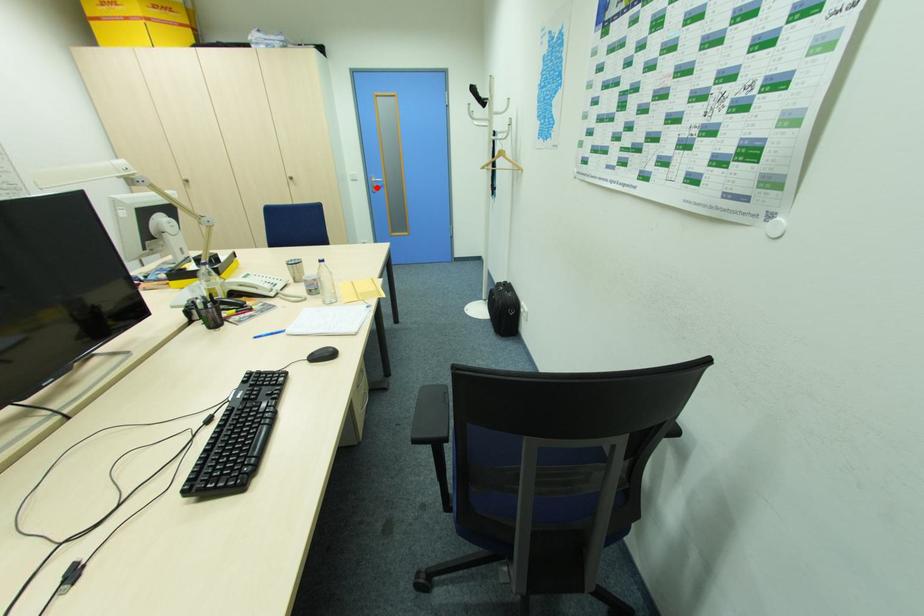
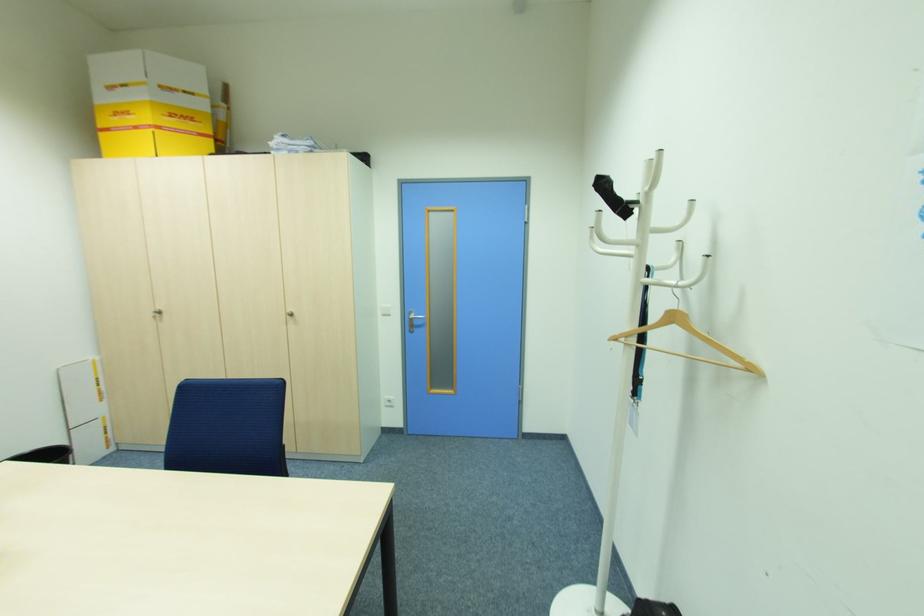
Locate, in the second image, the point that corresponds to the highlighted location in the first image.

(415, 325)